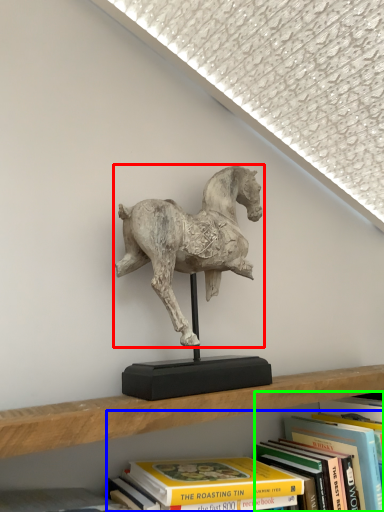
Question: Considering the real-world distances, which object is closest to horse (highlighted by a red box)? book (highlighted by a blue box) or book (highlighted by a green box).

Choices:
 (A) book
 (B) book

Answer: (A)